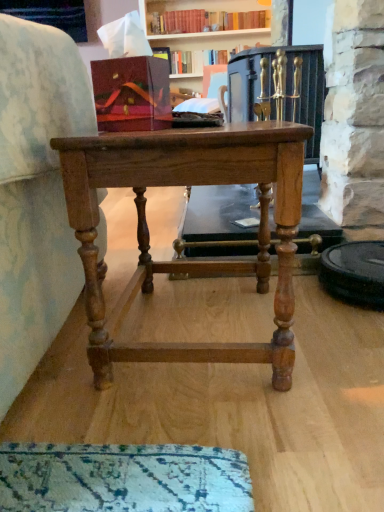
Question: Is matte wood cabinet at upper left thinner than light brown wood table at center?

Choices:
 (A) no
 (B) yes

Answer: (B)

Question: Is the position of matte wood cabinet at upper left more distant than that of light brown wood table at center?

Choices:
 (A) no
 (B) yes

Answer: (B)

Question: From the image's perspective, is matte wood cabinet at upper left on light brown wood table at center?

Choices:
 (A) yes
 (B) no

Answer: (A)

Question: Could you tell me if matte wood cabinet at upper left is turned towards light brown wood table at center?

Choices:
 (A) yes
 (B) no

Answer: (A)

Question: Is light brown wood table at center located within matte wood cabinet at upper left?

Choices:
 (A) yes
 (B) no

Answer: (B)

Question: Considering the positions of point (261, 249) and point (13, 0), is point (261, 249) closer or farther from the camera than point (13, 0)?

Choices:
 (A) farther
 (B) closer

Answer: (B)

Question: Considering the positions of light brown wood table at center and matte wood cabinet at upper left in the image, is light brown wood table at center bigger or smaller than matte wood cabinet at upper left?

Choices:
 (A) small
 (B) big

Answer: (B)

Question: From the image's perspective, relative to matte wood cabinet at upper left, is light brown wood table at center above or below?

Choices:
 (A) above
 (B) below

Answer: (B)

Question: Considering the positions of light brown wood table at center and matte wood cabinet at upper left in the image, is light brown wood table at center wider or thinner than matte wood cabinet at upper left?

Choices:
 (A) thin
 (B) wide

Answer: (B)

Question: Is point (51, 12) closer or farther from the camera than point (291, 305)?

Choices:
 (A) closer
 (B) farther

Answer: (B)

Question: Choose the correct answer: Is matte wood cabinet at upper left inside light brown wood table at center or outside it?

Choices:
 (A) inside
 (B) outside

Answer: (B)

Question: Considering the positions of matte wood cabinet at upper left and light brown wood table at center in the image, is matte wood cabinet at upper left bigger or smaller than light brown wood table at center?

Choices:
 (A) big
 (B) small

Answer: (B)

Question: Is matte wood cabinet at upper left in front of or behind light brown wood table at center in the image?

Choices:
 (A) front
 (B) behind

Answer: (B)

Question: Considering the positions of hardcover book at upper center and matte wood cabinet at upper left in the image, is hardcover book at upper center wider or thinner than matte wood cabinet at upper left?

Choices:
 (A) thin
 (B) wide

Answer: (B)

Question: Is hardcover book at upper center bigger or smaller than matte wood cabinet at upper left?

Choices:
 (A) small
 (B) big

Answer: (A)